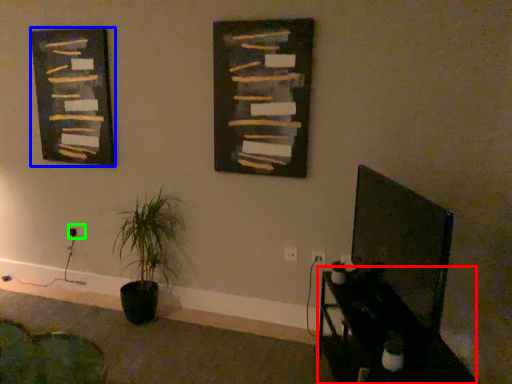
Question: Based on their relative distances, which object is farther from table (highlighted by a red box)? Choose from picture frame (highlighted by a blue box) and electric outlet (highlighted by a green box).

Choices:
 (A) picture frame
 (B) electric outlet

Answer: (B)